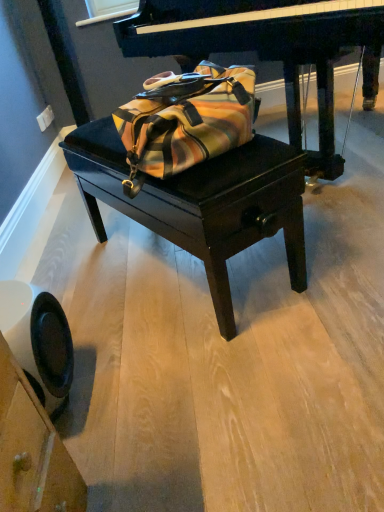
Question: Considering the relative sizes of polished dark wood piano at center and black plastic swivel chair at lower left in the image provided, is polished dark wood piano at center shorter than black plastic swivel chair at lower left?

Choices:
 (A) no
 (B) yes

Answer: (A)

Question: From the image's perspective, is polished dark wood piano at center above black plastic swivel chair at lower left?

Choices:
 (A) yes
 (B) no

Answer: (A)

Question: Is polished dark wood piano at center aimed at black plastic swivel chair at lower left?

Choices:
 (A) no
 (B) yes

Answer: (B)

Question: From a real-world perspective, is polished dark wood piano at center positioned under black plastic swivel chair at lower left based on gravity?

Choices:
 (A) yes
 (B) no

Answer: (B)

Question: Is polished dark wood piano at center outside black plastic swivel chair at lower left?

Choices:
 (A) yes
 (B) no

Answer: (A)

Question: In the image, is black plastic swivel chair at lower left on the left side or the right side of polished dark wood piano at center?

Choices:
 (A) right
 (B) left

Answer: (B)

Question: Is point (44, 358) closer or farther from the camera than point (317, 40)?

Choices:
 (A) closer
 (B) farther

Answer: (A)

Question: In terms of size, does black plastic swivel chair at lower left appear bigger or smaller than polished dark wood piano at center?

Choices:
 (A) big
 (B) small

Answer: (B)

Question: Do you think black plastic swivel chair at lower left is within polished dark wood piano at center, or outside of it?

Choices:
 (A) outside
 (B) inside

Answer: (A)

Question: Considering the positions of polished dark wood piano at center and velvet black table at center in the image, is polished dark wood piano at center bigger or smaller than velvet black table at center?

Choices:
 (A) big
 (B) small

Answer: (A)

Question: From their relative heights in the image, would you say polished dark wood piano at center is taller or shorter than velvet black table at center?

Choices:
 (A) tall
 (B) short

Answer: (A)

Question: Relative to velvet black table at center, is polished dark wood piano at center in front or behind?

Choices:
 (A) front
 (B) behind

Answer: (B)

Question: Is polished dark wood piano at center wider or thinner than velvet black table at center?

Choices:
 (A) wide
 (B) thin

Answer: (A)

Question: Relative to polished dark wood piano at center, is velvet black table at center in front or behind?

Choices:
 (A) behind
 (B) front

Answer: (B)

Question: Does point (251, 202) appear closer or farther from the camera than point (178, 36)?

Choices:
 (A) closer
 (B) farther

Answer: (A)